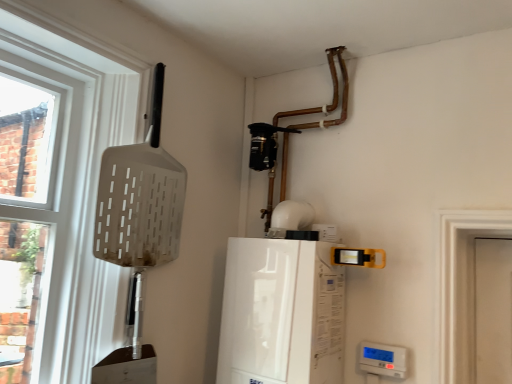
Question: From the image's perspective, would you say white plastic shovel at left is shown under white glossy boiler at center, the first appliance when ordered from top to bottom?

Choices:
 (A) no
 (B) yes

Answer: (A)

Question: Does white plastic shovel at left have a greater width compared to white glossy boiler at center, arranged as the second appliance when viewed from the right?

Choices:
 (A) yes
 (B) no

Answer: (B)

Question: Is white plastic shovel at left not close to white glossy boiler at center, the second appliance ordered from the bottom?

Choices:
 (A) yes
 (B) no

Answer: (B)

Question: Is white plastic shovel at left directly adjacent to white glossy boiler at center, arranged as the second appliance when viewed from the right?

Choices:
 (A) no
 (B) yes

Answer: (A)

Question: Does white plastic shovel at left appear on the left side of white glossy boiler at center, the first appliance when ordered from top to bottom?

Choices:
 (A) no
 (B) yes

Answer: (B)

Question: Do you think white plastic shovel at left is within white glossy boiler at center, the first appliance when ordered from top to bottom, or outside of it?

Choices:
 (A) inside
 (B) outside

Answer: (B)

Question: From their relative heights in the image, would you say white plastic shovel at left is taller or shorter than white glossy boiler at center, which appears as the first appliance when viewed from the left?

Choices:
 (A) tall
 (B) short

Answer: (A)

Question: From a real-world perspective, is white plastic shovel at left physically located above or below white glossy boiler at center, the first appliance when ordered from top to bottom?

Choices:
 (A) below
 (B) above

Answer: (B)

Question: From the image's perspective, is white plastic shovel at left positioned above or below white glossy boiler at center, the second appliance ordered from the bottom?

Choices:
 (A) below
 (B) above

Answer: (B)

Question: From a real-world perspective, is white glossy boiler at center, the second appliance ordered from the bottom, above or below white plastic shovel at left?

Choices:
 (A) above
 (B) below

Answer: (B)

Question: Considering the positions of white glossy boiler at center, arranged as the second appliance when viewed from the right, and white plastic shovel at left in the image, is white glossy boiler at center, arranged as the second appliance when viewed from the right, taller or shorter than white plastic shovel at left?

Choices:
 (A) short
 (B) tall

Answer: (A)

Question: Is white glossy boiler at center, the second appliance ordered from the bottom, bigger or smaller than white plastic shovel at left?

Choices:
 (A) big
 (B) small

Answer: (A)

Question: Is white glossy boiler at center, which appears as the first appliance when viewed from the left, inside the boundaries of white plastic shovel at left, or outside?

Choices:
 (A) outside
 (B) inside

Answer: (A)

Question: Does point (246, 319) appear closer or farther from the camera than point (370, 372)?

Choices:
 (A) farther
 (B) closer

Answer: (A)

Question: From the image's perspective, is white glossy boiler at center, which appears as the first appliance when viewed from the left, located above or below white plastic thermostat at lower right, which is the 2th appliance from top to bottom?

Choices:
 (A) above
 (B) below

Answer: (A)